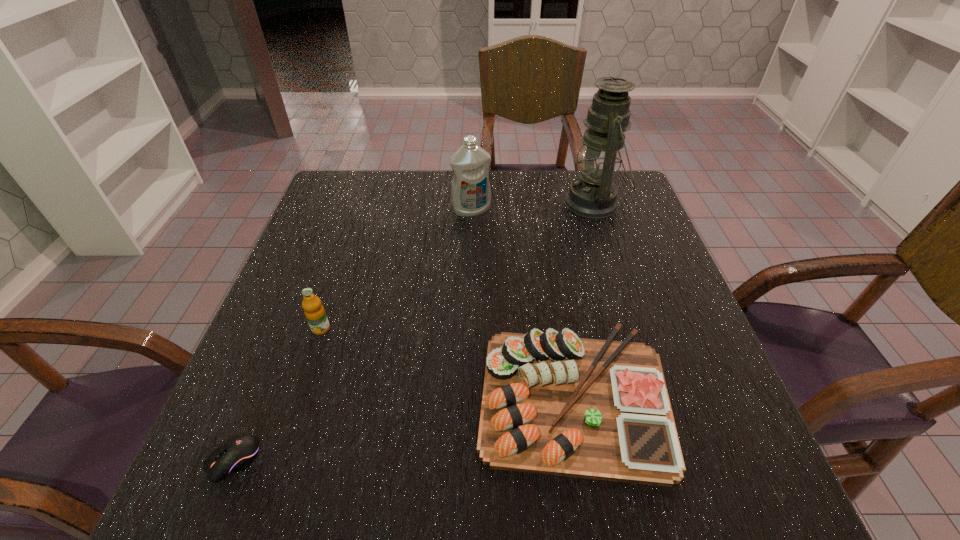
You are a GUI agent. You are given a task and a screenshot of the screen. Output one action in this format:
    pyautogui.click(x=<x>, y=<y>)
    Task: Click on the blank space located on the back of the platter
    The width and height of the screenshot is (960, 540).
    Given the screenshot: What is the action you would take?
    pyautogui.click(x=544, y=227)

This screenshot has width=960, height=540. I want to click on vacant area situated on the right of the computer mouse, so click(x=417, y=460).

Identify the location of oil lamp located in the far edge section of the desktop. (593, 195).

You are a GUI agent. You are given a task and a screenshot of the screen. Output one action in this format:
    pyautogui.click(x=<x>, y=<y>)
    Task: Click on the detergent that is at the far edge
    This screenshot has height=540, width=960.
    Given the screenshot: What is the action you would take?
    pyautogui.click(x=470, y=191)

Find the location of `platter at the near edge`. platter at the near edge is located at coordinates (553, 403).

Where is `computer mouse positioned at the near edge`? computer mouse positioned at the near edge is located at coordinates (234, 455).

Identify the location of orange juice located in the left edge section of the desktop. (315, 314).

You are a GUI agent. You are given a task and a screenshot of the screen. Output one action in this format:
    pyautogui.click(x=<x>, y=<y>)
    Task: Click on the computer mouse positioned at the left edge
    
    Given the screenshot: What is the action you would take?
    pyautogui.click(x=234, y=455)

I want to click on oil lamp that is at the right edge, so click(593, 195).

Identify the location of platter that is positioned at the right edge. (553, 403).